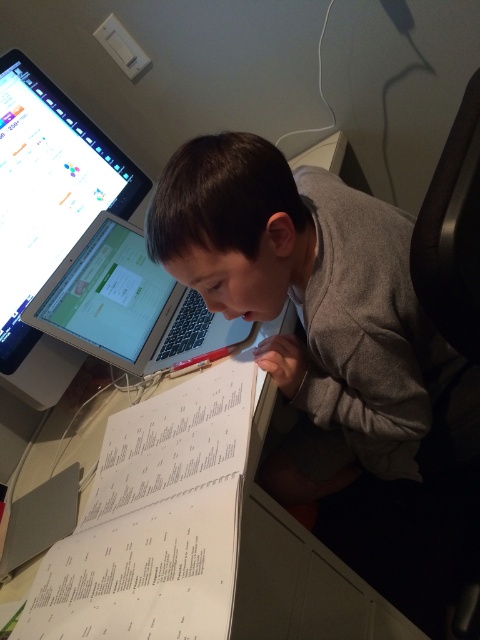
Who is positioned more to the right, white paper at lower left or matte black monitor at upper left?

white paper at lower left is more to the right.

Between point (115, 561) and point (82, 211), which one is positioned behind?

The point (82, 211) is behind.

This screenshot has height=640, width=480. What do you see at coordinates (155, 522) in the screenshot?
I see `white paper at lower left` at bounding box center [155, 522].

I want to click on white paper at lower left, so click(x=155, y=522).

Can you confirm if white paper at lower left is thinner than gray cotton shirt at center?

No, white paper at lower left is not thinner than gray cotton shirt at center.

Who is more distant from viewer, (x=171, y=534) or (x=239, y=269)?

The point (x=239, y=269) is more distant.

What do you see at coordinates (155, 522) in the screenshot? I see `white paper at lower left` at bounding box center [155, 522].

Find the location of a particular element. white paper at lower left is located at coordinates (155, 522).

Does gray cotton shirt at center come behind matte black monitor at upper left?

That is False.

How far apart are gray cotton shirt at center and matte black monitor at upper left?

A distance of 17.52 inches exists between gray cotton shirt at center and matte black monitor at upper left.

Which is in front, point (286, 364) or point (28, 272)?

Point (286, 364) is in front.

The width and height of the screenshot is (480, 640). I want to click on gray cotton shirt at center, so click(x=232, y=225).